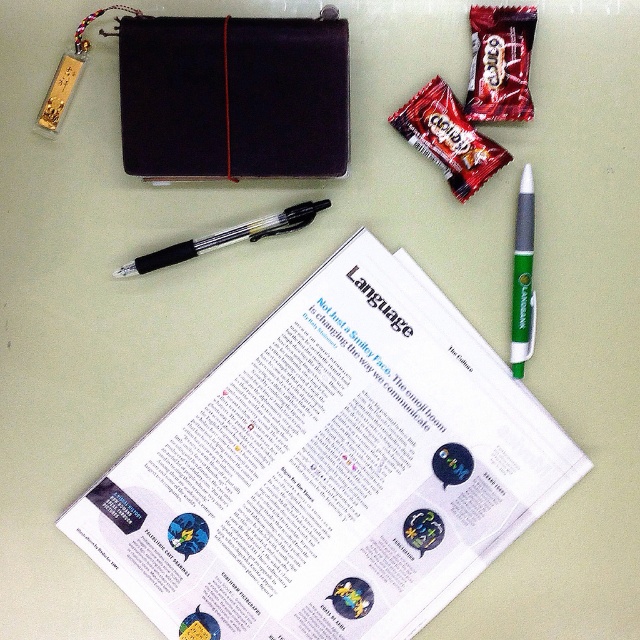
Question: Can you confirm if black leather folder at upper center is positioned above green plastic pen at upper right?

Choices:
 (A) yes
 (B) no

Answer: (A)

Question: Can you confirm if green plastic pen at upper right is thinner than transparent plastic pen at center?

Choices:
 (A) yes
 (B) no

Answer: (A)

Question: Is black leather folder at upper center further to the viewer compared to transparent plastic pen at center?

Choices:
 (A) yes
 (B) no

Answer: (B)

Question: Which object is the closest to the white paper at center?

Choices:
 (A) black leather folder at upper center
 (B) green plastic pen at upper right
 (C) transparent plastic pen at center

Answer: (C)

Question: Based on their relative distances, which object is farther from the green plastic pen at upper right?

Choices:
 (A) black leather folder at upper center
 (B) white paper at center

Answer: (A)

Question: Which object is closer to the camera taking this photo?

Choices:
 (A) black leather folder at upper center
 (B) green plastic pen at upper right
 (C) transparent plastic pen at center

Answer: (A)